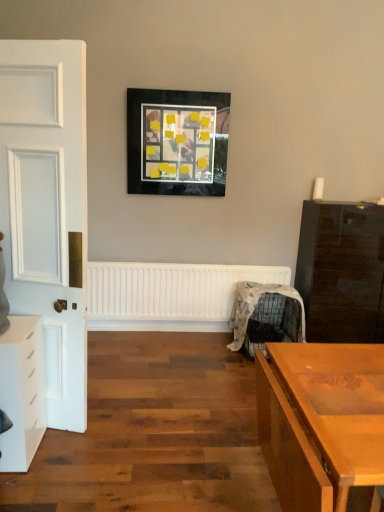
Question: Looking at their shapes, would you say white matte radiator at center is wider or thinner than metallic wire swivel chair at center-right?

Choices:
 (A) wide
 (B) thin

Answer: (B)

Question: Is white matte radiator at center bigger or smaller than metallic wire swivel chair at center-right?

Choices:
 (A) small
 (B) big

Answer: (A)

Question: Considering the real-world distances, which object is farthest from the glossy dark wood chest of drawers at right, which is counted as the second chest of drawers, starting from the front?

Choices:
 (A) white matte chest of drawers at left, which is the first chest of drawers from left to right
 (B) matte black picture frame at upper center
 (C) metallic wire swivel chair at center-right
 (D) white matte radiator at center

Answer: (A)

Question: Which of these objects is positioned closest to the metallic wire swivel chair at center-right?

Choices:
 (A) white matte chest of drawers at left, the first chest of drawers in the front-to-back sequence
 (B) white matte radiator at center
 (C) glossy dark wood chest of drawers at right, which is the first chest of drawers from back to front
 (D) matte black picture frame at upper center

Answer: (C)